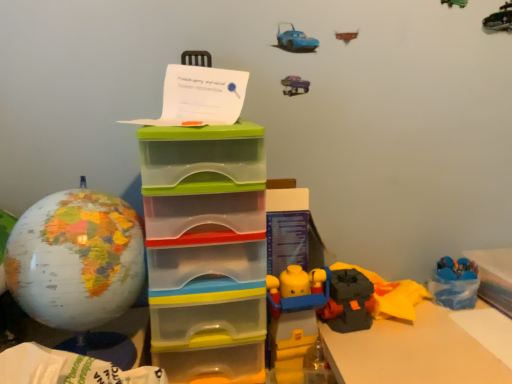
Question: Does translucent plastic storage box at center, the second storage box when ordered from right to left, have a greater height compared to blue plastic storage box at lower right, which ranks as the 2th storage box in left-to-right order?

Choices:
 (A) no
 (B) yes

Answer: (B)

Question: Does translucent plastic storage box at center, the second storage box when ordered from right to left, have a smaller size compared to blue plastic storage box at lower right, which ranks as the 2th storage box in left-to-right order?

Choices:
 (A) yes
 (B) no

Answer: (B)

Question: Can we say translucent plastic storage box at center, the second storage box when ordered from right to left, lies outside blue plastic storage box at lower right, which ranks as the first storage box in right-to-left order?

Choices:
 (A) yes
 (B) no

Answer: (A)

Question: From the image's perspective, is translucent plastic storage box at center, the second storage box when ordered from right to left, below blue plastic storage box at lower right, which ranks as the first storage box in right-to-left order?

Choices:
 (A) no
 (B) yes

Answer: (A)

Question: Is translucent plastic storage box at center, arranged as the 1th storage box when viewed from the left, positioned with its back to blue plastic storage box at lower right, which ranks as the 2th storage box in left-to-right order?

Choices:
 (A) yes
 (B) no

Answer: (B)

Question: Are translucent plastic storage box at center, the second storage box when ordered from right to left, and blue plastic storage box at lower right, which ranks as the 2th storage box in left-to-right order, beside each other?

Choices:
 (A) yes
 (B) no

Answer: (B)

Question: Does matte globe at left turn towards translucent plastic storage box at center, the second storage box when ordered from right to left?

Choices:
 (A) yes
 (B) no

Answer: (B)

Question: From a real-world perspective, is matte globe at left on translucent plastic storage box at center, the second storage box when ordered from right to left?

Choices:
 (A) no
 (B) yes

Answer: (B)

Question: Can you see matte globe at left touching translucent plastic storage box at center, arranged as the 1th storage box when viewed from the left?

Choices:
 (A) yes
 (B) no

Answer: (B)

Question: From the image's perspective, would you say matte globe at left is positioned over translucent plastic storage box at center, arranged as the 1th storage box when viewed from the left?

Choices:
 (A) yes
 (B) no

Answer: (A)

Question: Is matte globe at left thinner than translucent plastic storage box at center, arranged as the 1th storage box when viewed from the left?

Choices:
 (A) yes
 (B) no

Answer: (A)

Question: Considering the relative positions of matte globe at left and translucent plastic storage box at center, arranged as the 1th storage box when viewed from the left, in the image provided, is matte globe at left behind translucent plastic storage box at center, arranged as the 1th storage box when viewed from the left,?

Choices:
 (A) no
 (B) yes

Answer: (A)

Question: Can you confirm if translucent plastic storage box at center, the second storage box when ordered from right to left, is thinner than matte globe at left?

Choices:
 (A) yes
 (B) no

Answer: (B)